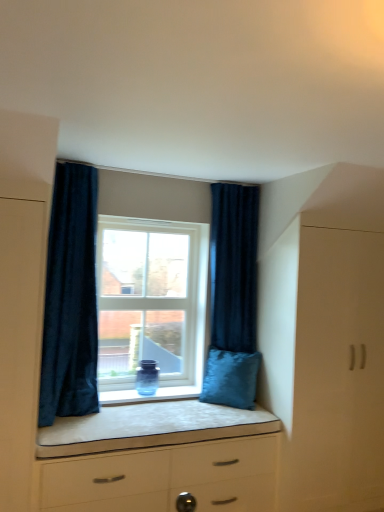
Question: Is dark blue velvet curtain at right, acting as the first curtain starting from the back, smaller than white matte cabinet at right?

Choices:
 (A) no
 (B) yes

Answer: (B)

Question: Considering the relative sizes of dark blue velvet curtain at right, acting as the first curtain starting from the back, and white matte cabinet at right in the image provided, is dark blue velvet curtain at right, acting as the first curtain starting from the back, shorter than white matte cabinet at right?

Choices:
 (A) no
 (B) yes

Answer: (B)

Question: Considering the relative sizes of dark blue velvet curtain at right, acting as the first curtain starting from the back, and white matte cabinet at right in the image provided, is dark blue velvet curtain at right, acting as the first curtain starting from the back, bigger than white matte cabinet at right?

Choices:
 (A) yes
 (B) no

Answer: (B)

Question: Considering the relative sizes of dark blue velvet curtain at right, which is the second curtain from front to back, and white matte cabinet at right in the image provided, is dark blue velvet curtain at right, which is the second curtain from front to back, wider than white matte cabinet at right?

Choices:
 (A) no
 (B) yes

Answer: (A)

Question: Is dark blue velvet curtain at right, the 1th curtain positioned from the right, to the right of white matte cabinet at right from the viewer's perspective?

Choices:
 (A) no
 (B) yes

Answer: (A)

Question: Considering the positions of white glossy chest of drawers at center and clear glass window at center in the image, is white glossy chest of drawers at center wider or thinner than clear glass window at center?

Choices:
 (A) wide
 (B) thin

Answer: (A)

Question: Considering the relative positions of white glossy chest of drawers at center and clear glass window at center in the image provided, is white glossy chest of drawers at center to the left or to the right of clear glass window at center?

Choices:
 (A) right
 (B) left

Answer: (A)

Question: From a real-world perspective, is white glossy chest of drawers at center positioned above or below clear glass window at center?

Choices:
 (A) below
 (B) above

Answer: (A)

Question: Is point (177, 433) positioned closer to the camera than point (175, 323)?

Choices:
 (A) closer
 (B) farther

Answer: (A)

Question: Is white glossy chest of drawers at center to the left or to the right of white matte cabinet at right in the image?

Choices:
 (A) right
 (B) left

Answer: (B)

Question: From their relative heights in the image, would you say white glossy chest of drawers at center is taller or shorter than white matte cabinet at right?

Choices:
 (A) tall
 (B) short

Answer: (B)

Question: Considering the positions of point (220, 428) and point (314, 364), is point (220, 428) closer or farther from the camera than point (314, 364)?

Choices:
 (A) closer
 (B) farther

Answer: (A)

Question: Considering the positions of white glossy chest of drawers at center and white matte cabinet at right in the image, is white glossy chest of drawers at center bigger or smaller than white matte cabinet at right?

Choices:
 (A) small
 (B) big

Answer: (B)

Question: Looking at the image, does dark blue velvet curtain at right, the 1th curtain positioned from the right, seem bigger or smaller compared to dark blue velvet curtain at left, marked as the first curtain in a front-to-back arrangement?

Choices:
 (A) small
 (B) big

Answer: (A)

Question: Considering the positions of dark blue velvet curtain at right, the second curtain from the left, and dark blue velvet curtain at left, marked as the first curtain in a front-to-back arrangement, in the image, is dark blue velvet curtain at right, the second curtain from the left, wider or thinner than dark blue velvet curtain at left, marked as the first curtain in a front-to-back arrangement,?

Choices:
 (A) thin
 (B) wide

Answer: (A)